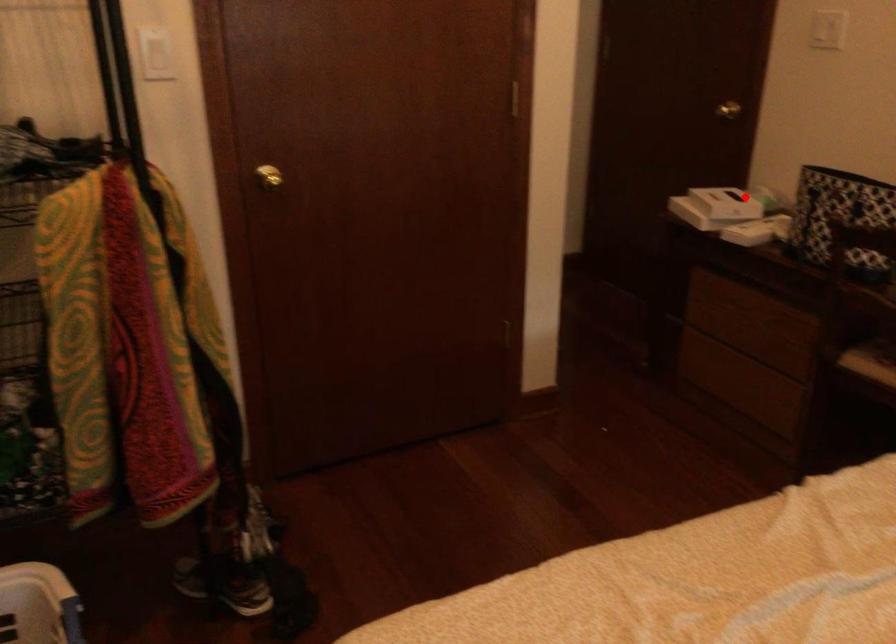
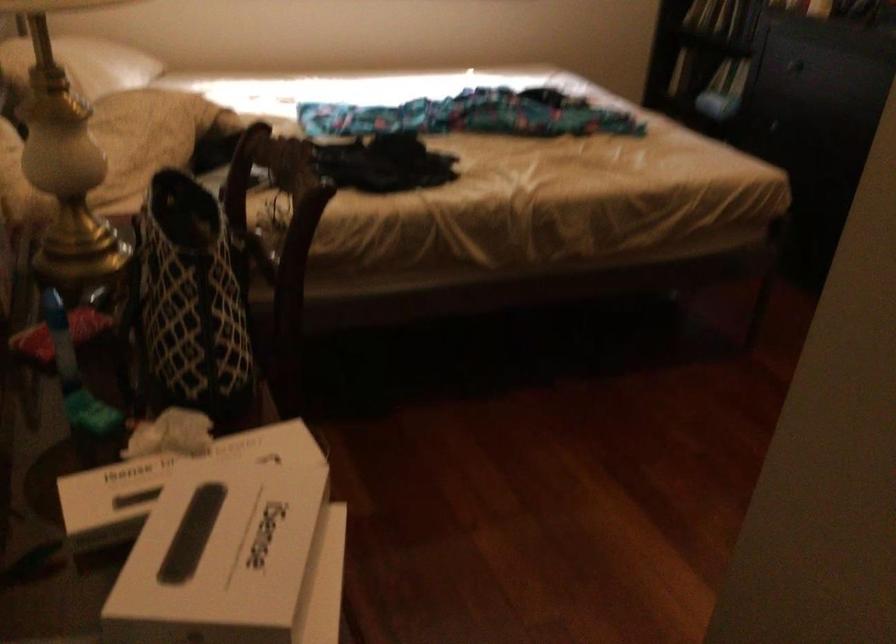
In the second image, find the point that corresponds to the highlighted location in the first image.

(168, 477)